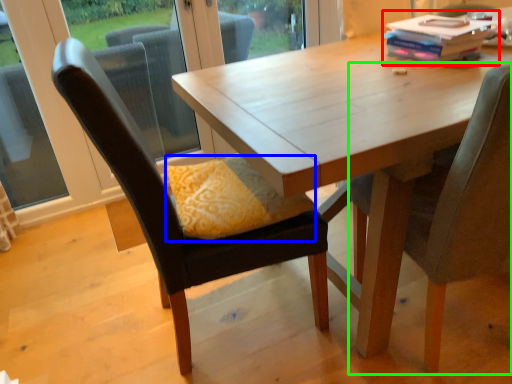
Question: Which object is the closest to the book (highlighted by a red box)? Choose among these: pillow (highlighted by a blue box) or chair (highlighted by a green box).

Choices:
 (A) pillow
 (B) chair

Answer: (B)